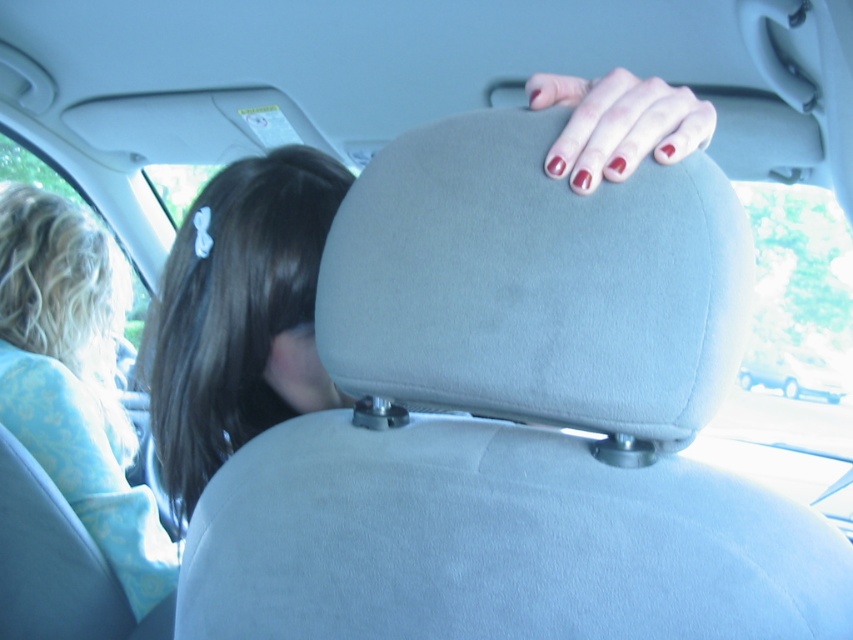
Question: Which object is closer to the camera taking this photo?

Choices:
 (A) blonde hair at left
 (B) matte red nails at upper center

Answer: (B)

Question: Is blonde hair at left bigger than matte red nails at upper center?

Choices:
 (A) yes
 (B) no

Answer: (A)

Question: Among these objects, which one is farthest from the camera?

Choices:
 (A) dark brown hair at upper left
 (B) matte red nails at upper center

Answer: (A)

Question: Which object is closer to the camera taking this photo?

Choices:
 (A) dark brown hair at upper left
 (B) white matte van at upper center

Answer: (A)

Question: Can you confirm if blonde hair at left is positioned below matte red nails at upper center?

Choices:
 (A) yes
 (B) no

Answer: (A)

Question: Can you confirm if dark brown hair at upper left is positioned to the right of white matte van at upper center?

Choices:
 (A) yes
 (B) no

Answer: (B)